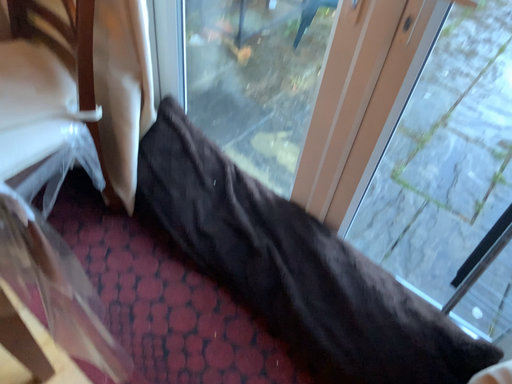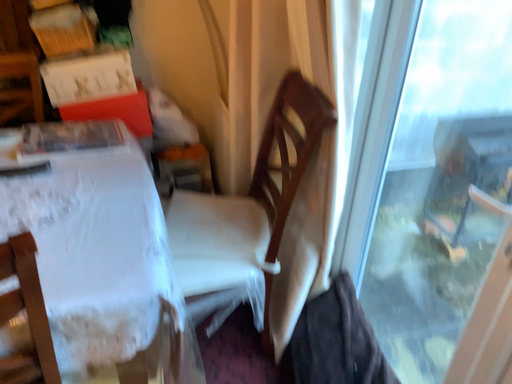
Question: How did the camera likely rotate when shooting the video?

Choices:
 (A) rotated downward
 (B) rotated upward

Answer: (B)